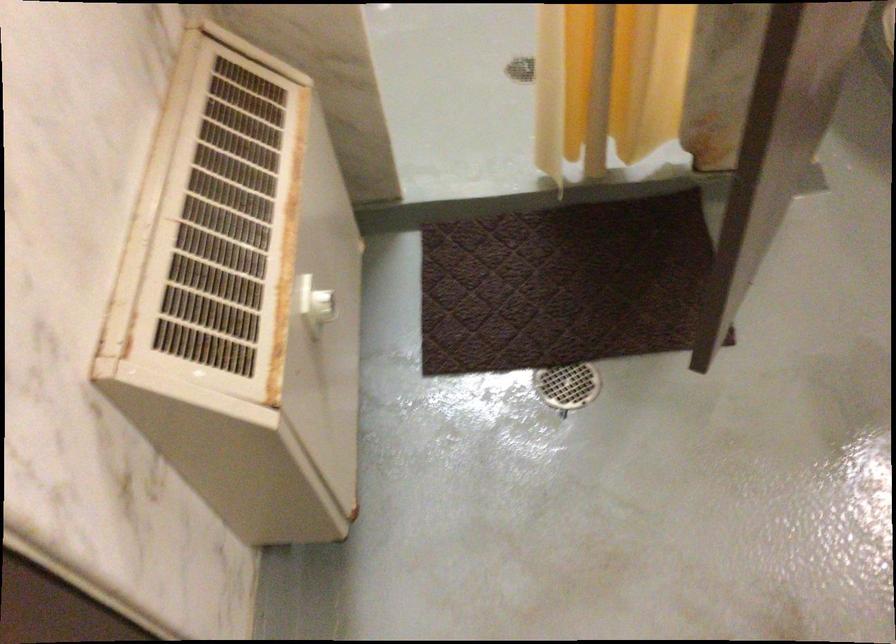
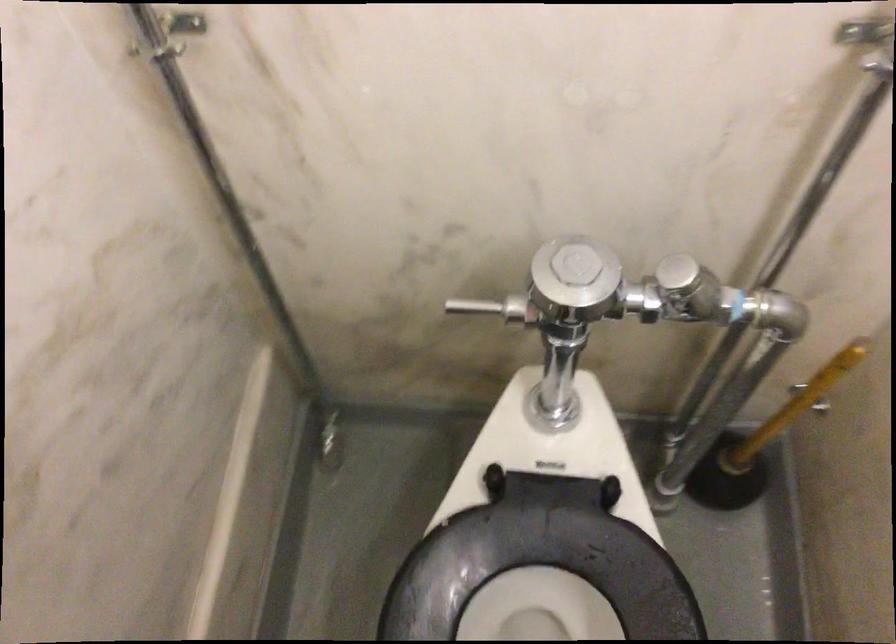
Based on the photo, in a continuous first-person perspective shot, in which direction is the camera moving?

The cameraman walked toward right, forward.